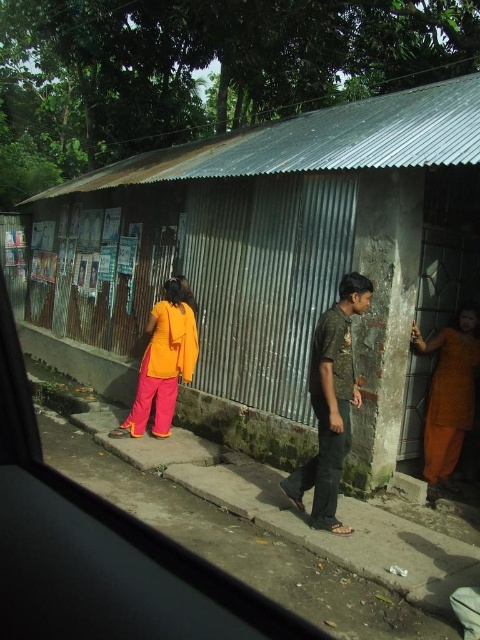
Question: Which point appears closest to the camera in this image?

Choices:
 (A) (315, 502)
 (B) (367, 168)

Answer: (A)

Question: Which of the following is the farthest from the observer?

Choices:
 (A) orange fabric dress at right
 (B) matte orange dress at center

Answer: (B)

Question: Can you confirm if transparent glass car window at center is positioned to the right of orange fabric dress at right?

Choices:
 (A) yes
 (B) no

Answer: (B)

Question: Considering the relative positions of corrugated metal hut at center and orange fabric dress at right in the image provided, where is corrugated metal hut at center located with respect to orange fabric dress at right?

Choices:
 (A) above
 (B) below

Answer: (A)

Question: Is camouflage-patterned shirt at center to the left of orange fabric dress at right from the viewer's perspective?

Choices:
 (A) no
 (B) yes

Answer: (B)

Question: Which object is farther from the camera taking this photo?

Choices:
 (A) corrugated metal hut at center
 (B) camouflage-patterned shirt at center
 (C) matte orange dress at center

Answer: (C)